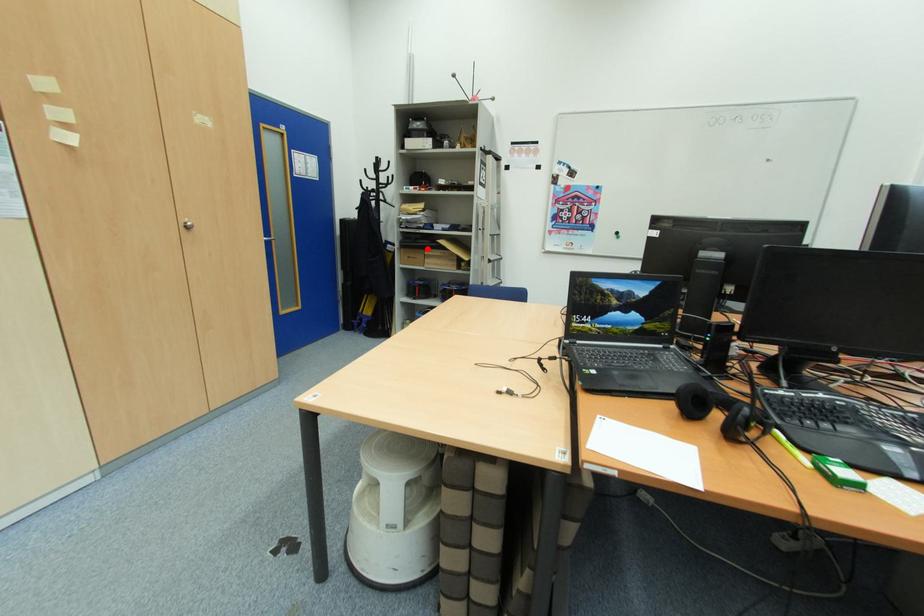
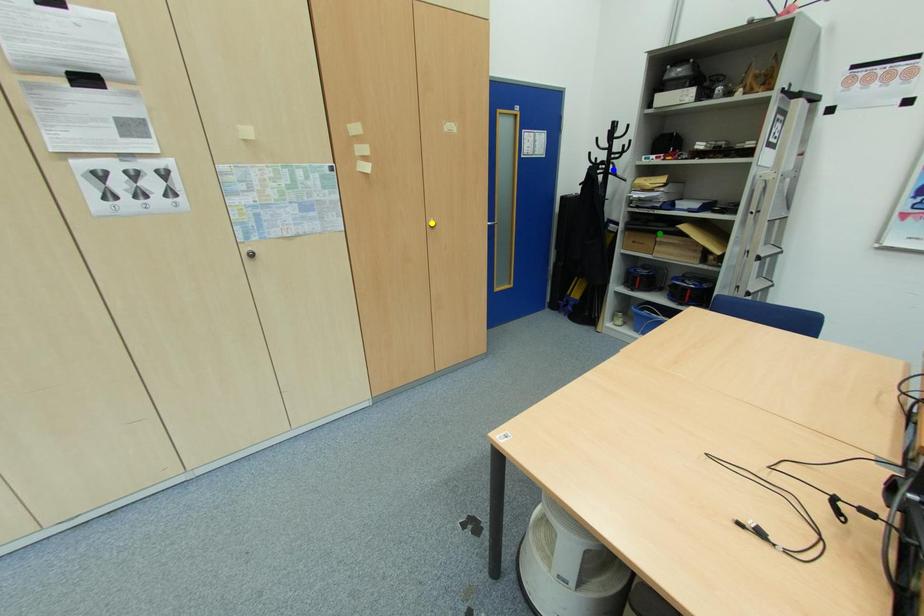
Question: I am providing you with two images of the same scene from different viewpoints. A red point is marked on the first image. You are given multiple points on the second image. In image 2, which mark is for the same physical point as the one in image 1?

Choices:
 (A) green point
 (B) yellow point
 (C) blue point

Answer: (A)